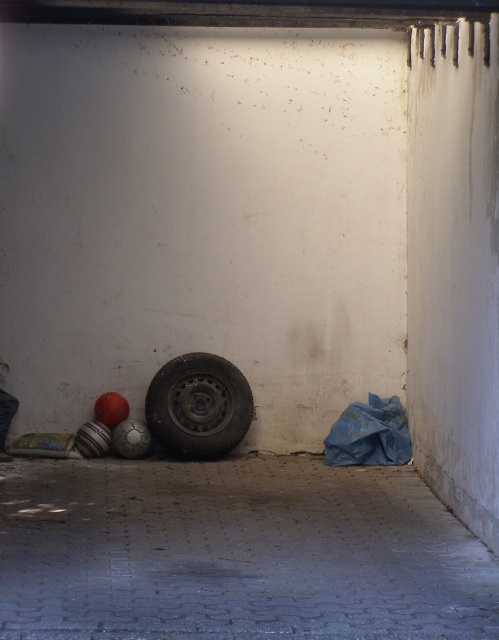
You are standing on the smooth concrete floor at center and want to move to the black rubber tire at lower left. Which direction should you move to reach it?

You should move backward to reach the black rubber tire at lower left because the smooth concrete floor at center is in front of it.

You are a delivery person who needs to place a heavy box on the smooth concrete floor at center. However, there is a black rubber tire at lower left in the way. Can you move the tire to access the floor?

The smooth concrete floor at center is positioned under the black rubber tire at lower left, meaning the tire is currently blocking access to the floor. You will need to move the tire to place the box there.

You are a delivery person who needs to place a large box in this garage. The box requires a flat surface that is at least 4 meters away from the black rubber tire at lower left. Can you use the smooth concrete floor at center for this purpose?

The smooth concrete floor at center and black rubber tire at lower left are 4.14 meters apart from each other. Since the required distance is at least 4 meters, the smooth concrete floor at center is suitable for placing the large box as it meets the distance requirement.